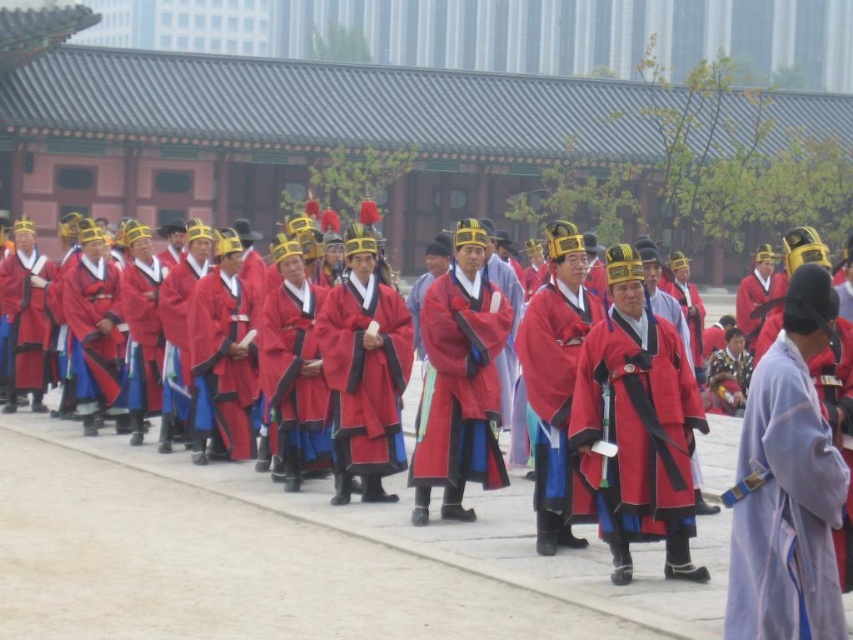
Is point (524, 545) more distant than point (786, 548)?

Yes, point (524, 545) is farther from viewer.

Who is lower down, matte red robe at center or light purple silk robe at right?

matte red robe at center

Is point (84, 604) farther from camera compared to point (805, 554)?

Yes, it is.

At what (x,y) coordinates should I click in order to perform the action: click on matte red robe at center. Please return your answer as a coordinate pair (x, y). The width and height of the screenshot is (853, 640). Looking at the image, I should click on (294, 556).